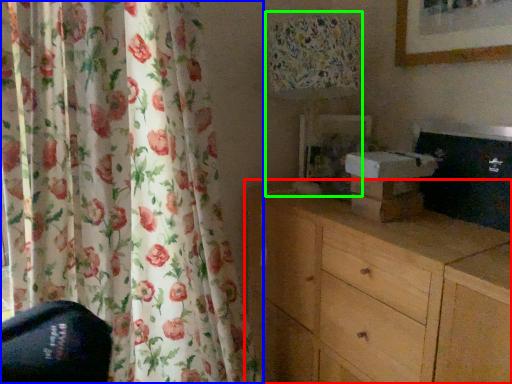
Question: Which object is positioned farthest from chest of drawers (highlighted by a red box)? Select from curtain (highlighted by a blue box) and table lamp (highlighted by a green box).

Choices:
 (A) curtain
 (B) table lamp

Answer: (A)